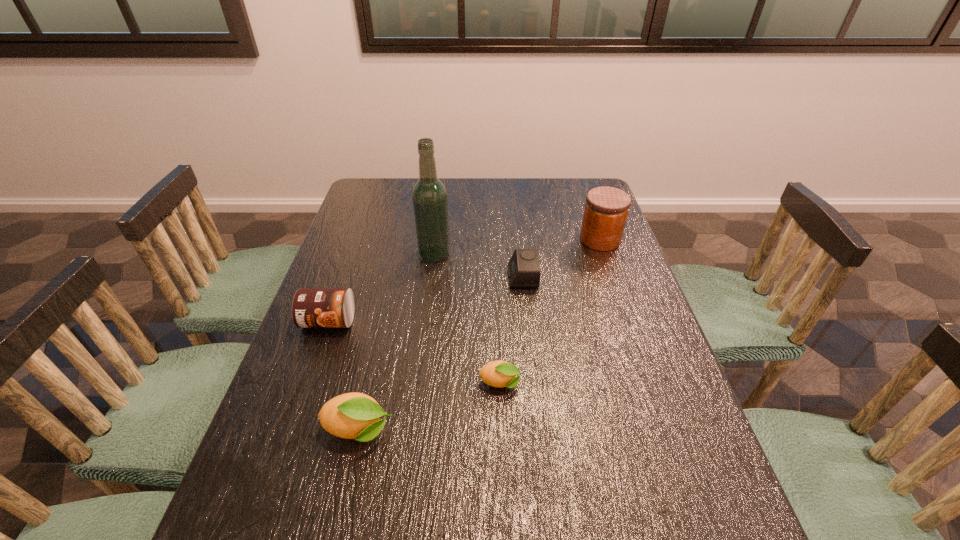
Locate an element on the screen. The image size is (960, 540). object present at the right edge is located at coordinates (606, 209).

This screenshot has height=540, width=960. I want to click on blank space at the far edge of the desktop, so click(468, 204).

You are a GUI agent. You are given a task and a screenshot of the screen. Output one action in this format:
    pyautogui.click(x=<x>, y=<y>)
    Task: Click on the vacant position at the near edge of the desktop
    
    Given the screenshot: What is the action you would take?
    pyautogui.click(x=378, y=483)

The image size is (960, 540). In order to click on blank space at the left edge in this screenshot , I will do `click(340, 368)`.

What are the coordinates of `vacant space at the right edge` in the screenshot? It's located at (644, 429).

The height and width of the screenshot is (540, 960). In order to click on free point at the far left corner in this screenshot , I will do `click(380, 202)`.

Locate an element on the screen. free point between the can and the alarm clock is located at coordinates (425, 299).

Locate an element on the screen. The width and height of the screenshot is (960, 540). free space that is in between the third farthest object and the fifth farthest object is located at coordinates (512, 330).

You are a GUI agent. You are given a task and a screenshot of the screen. Output one action in this format:
    pyautogui.click(x=<x>, y=<y>)
    Task: Click on the free point between the liquor and the third nearest object
    This screenshot has width=960, height=540.
    Given the screenshot: What is the action you would take?
    pyautogui.click(x=381, y=287)

The width and height of the screenshot is (960, 540). I want to click on free space that is in between the alarm clock and the second tallest object, so click(x=562, y=258).